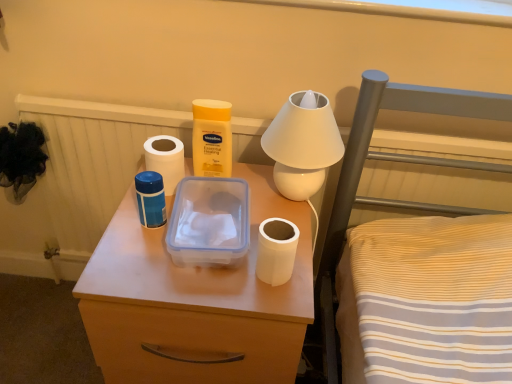
Question: Based on their sizes in the image, would you say matte plastic container at center is bigger or smaller than transparent plastic lunch box at center?

Choices:
 (A) big
 (B) small

Answer: (A)

Question: From the image's perspective, relative to transparent plastic lunch box at center, is matte plastic container at center above or below?

Choices:
 (A) below
 (B) above

Answer: (A)

Question: Considering the real-world distances, which object is farthest from the white matte toilet paper at left, the 1th toilet paper positioned from the left?

Choices:
 (A) matte plastic container at center
 (B) transparent plastic lunch box at center
 (C) white matte toilet paper at center, which appears as the 1th toilet paper when viewed from the front
 (D) blue plastic thermos at center
 (E) white glossy table lamp at upper center

Answer: (C)

Question: Estimate the real-world distances between objects in this image. Which object is closer to the transparent plastic lunch box at center?

Choices:
 (A) white matte toilet paper at center, which is the 1th toilet paper in bottom-to-top order
 (B) blue plastic thermos at center
 (C) matte plastic container at center
 (D) white matte toilet paper at left, the second toilet paper from the front
 (E) white glossy table lamp at upper center

Answer: (B)